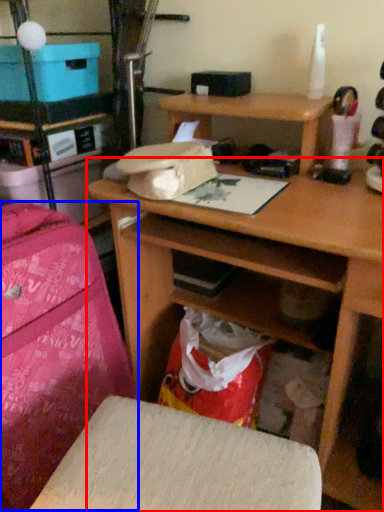
Question: Which object appears farthest to the camera in this image, desk (highlighted by a red box) or luggage (highlighted by a blue box)?

Choices:
 (A) desk
 (B) luggage

Answer: (B)